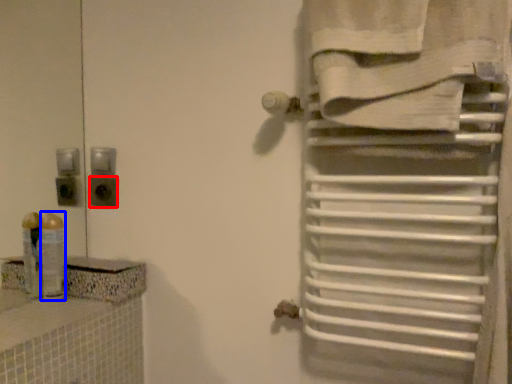
Question: Which of the following is the closest to the observer, electric outlet (highlighted by a red box) or toiletry (highlighted by a blue box)?

Choices:
 (A) electric outlet
 (B) toiletry

Answer: (B)